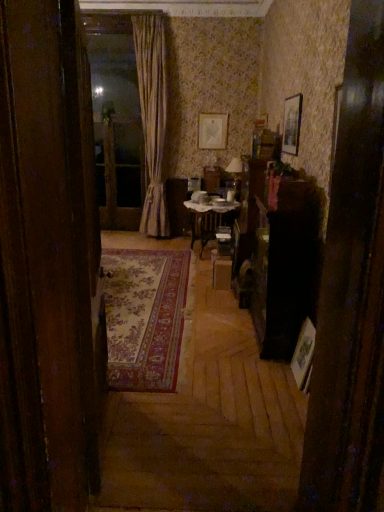
Where is `vacant space underneath wooden door at left (from a real-world perspective)`? This screenshot has height=512, width=384. vacant space underneath wooden door at left (from a real-world perspective) is located at coordinates point(115,430).